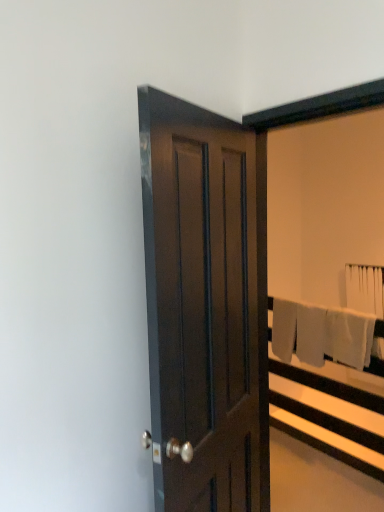
Question: Based on their positions, is dark wood door at center located to the left or right of white fabric bath towel at upper right, which appears as the second bath towel when viewed from the left?

Choices:
 (A) right
 (B) left

Answer: (B)

Question: From the image's perspective, relative to white fabric bath towel at upper right, acting as the first bath towel starting from the back, is dark wood door at center above or below?

Choices:
 (A) above
 (B) below

Answer: (B)

Question: Based on their relative distances, which object is nearer to the white cotton bath towel at right, acting as the 2th bath towel starting from the right?

Choices:
 (A) white fabric bed frame at right
 (B) dark wood door at center
 (C) white fabric bath towel at upper right, which appears as the second bath towel when viewed from the left

Answer: (A)

Question: Based on their relative distances, which object is nearer to the dark wood door at center?

Choices:
 (A) white fabric bed frame at right
 (B) white cotton bath towel at right, which is the 1th bath towel from left to right
 (C) white fabric bath towel at upper right, the 1th bath towel when ordered from right to left

Answer: (A)